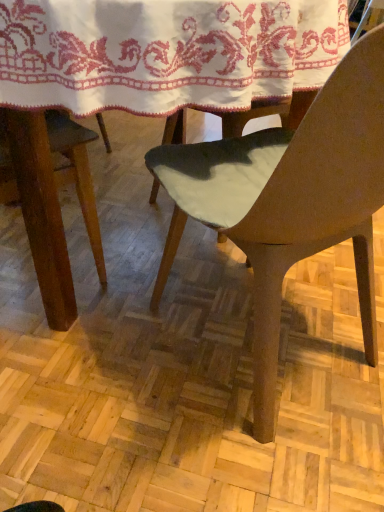
Question: Considering the relative positions of matte brown chair at center and white embroidered cloth at upper center in the image provided, is matte brown chair at center behind white embroidered cloth at upper center?

Choices:
 (A) yes
 (B) no

Answer: (B)

Question: Does matte brown chair at center have a greater height compared to white embroidered cloth at upper center?

Choices:
 (A) no
 (B) yes

Answer: (B)

Question: Can you confirm if matte brown chair at center is positioned to the left of white embroidered cloth at upper center?

Choices:
 (A) yes
 (B) no

Answer: (B)

Question: Would you say matte brown chair at center is a long distance from white embroidered cloth at upper center?

Choices:
 (A) yes
 (B) no

Answer: (B)

Question: Is matte brown chair at center outside of white embroidered cloth at upper center?

Choices:
 (A) no
 (B) yes

Answer: (B)

Question: Considering the relative sizes of matte brown chair at center and white embroidered cloth at upper center in the image provided, is matte brown chair at center thinner than white embroidered cloth at upper center?

Choices:
 (A) yes
 (B) no

Answer: (A)

Question: From a real-world perspective, is white embroidered cloth at upper center positioned under matte brown chair at center based on gravity?

Choices:
 (A) yes
 (B) no

Answer: (B)

Question: Is white embroidered cloth at upper center oriented away from matte brown chair at center?

Choices:
 (A) yes
 (B) no

Answer: (B)

Question: Considering the relative positions of white embroidered cloth at upper center and matte brown chair at center in the image provided, is white embroidered cloth at upper center in front of matte brown chair at center?

Choices:
 (A) yes
 (B) no

Answer: (B)

Question: From the image's perspective, is white embroidered cloth at upper center beneath matte brown chair at center?

Choices:
 (A) no
 (B) yes

Answer: (A)

Question: Is white embroidered cloth at upper center beside matte brown chair at center?

Choices:
 (A) no
 (B) yes

Answer: (A)

Question: From a real-world perspective, is white embroidered cloth at upper center on top of matte brown chair at center?

Choices:
 (A) yes
 (B) no

Answer: (A)

Question: Does point (26, 34) appear closer or farther from the camera than point (248, 192)?

Choices:
 (A) farther
 (B) closer

Answer: (B)